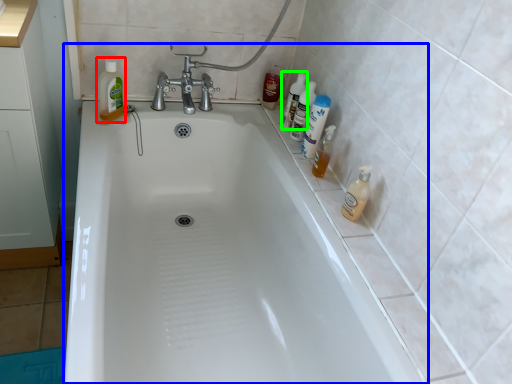
Question: Which is nearer to the cleaning product (highlighted by a red box)? bathtub (highlighted by a blue box) or cleaning product (highlighted by a green box).

Choices:
 (A) bathtub
 (B) cleaning product

Answer: (A)